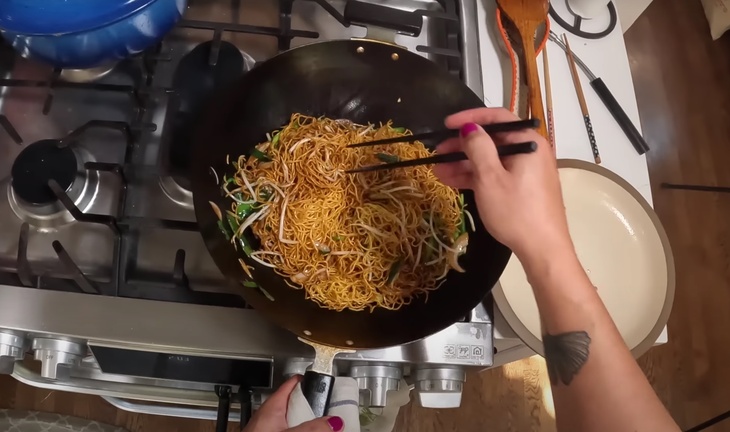
Locate an element on the screen. handle is located at coordinates (98, 383).